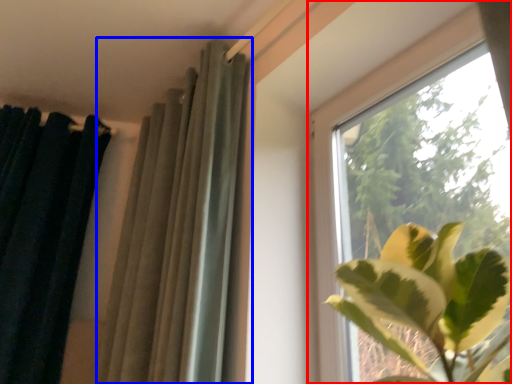
Question: Which object is further to the camera taking this photo, window (highlighted by a red box) or curtain (highlighted by a blue box)?

Choices:
 (A) window
 (B) curtain

Answer: (B)